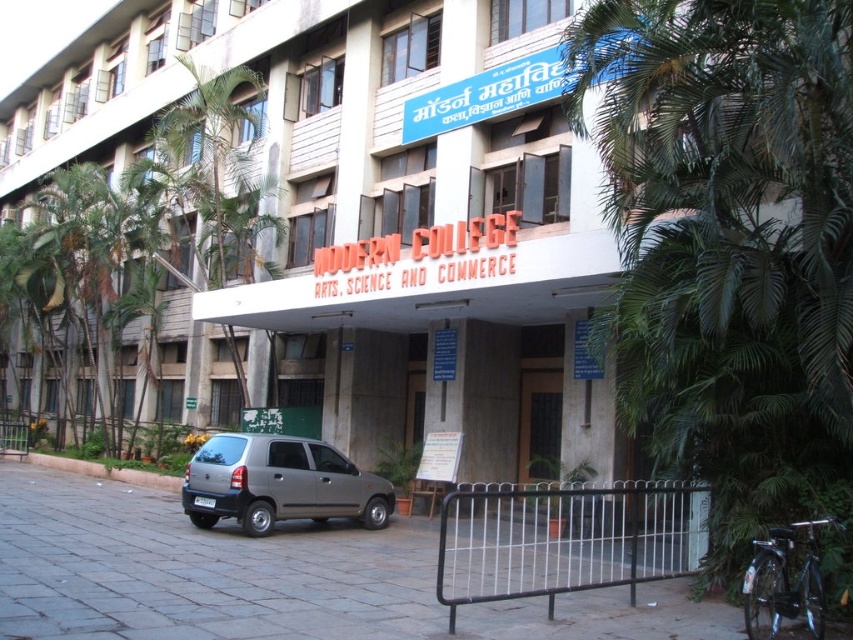
Is green leafy palm tree at upper left smaller than brown wooden door at center?

Correct, green leafy palm tree at upper left occupies less space than brown wooden door at center.

Is point (193, 180) positioned after point (525, 460)?

Yes, it is behind point (525, 460).

Image resolution: width=853 pixels, height=640 pixels. In order to click on green leafy palm tree at upper left in this screenshot , I will do `click(216, 172)`.

Between point (207, 106) and point (332, 458), which one is positioned in front?

Point (332, 458) is more forward.

Can you confirm if green leafy palm tree at upper left is positioned below satin silver car at lower left?

Incorrect, green leafy palm tree at upper left is not positioned below satin silver car at lower left.

What do you see at coordinates (216, 172) in the screenshot?
I see `green leafy palm tree at upper left` at bounding box center [216, 172].

Identify the location of green leafy palm tree at upper left. (216, 172).

How much distance is there between satin silver car at lower left and brown wooden door at center?

satin silver car at lower left is 14.97 feet away from brown wooden door at center.

Can you confirm if satin silver car at lower left is wider than brown wooden door at center?

Indeed, satin silver car at lower left has a greater width compared to brown wooden door at center.

Between point (216, 520) and point (526, 474), which one is positioned behind?

Point (526, 474)

Where is `satin silver car at lower left`? satin silver car at lower left is located at coordinates [279, 483].